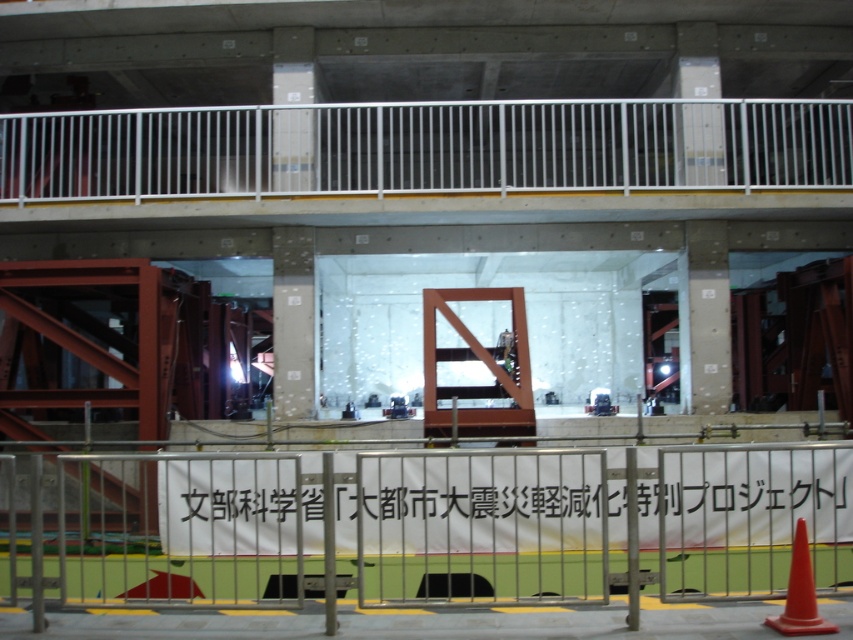
Consider the image. You are standing at the point labeled as point (433, 524) in the image. What object are you facing? Please answer with the object label from the scene.

The point (433, 524) corresponds to the silver metallic fence at lower center, so you are facing the silver metallic fence at lower center.

You are a visitor at the construction site and want to read the white paper banner at center. However, there is a silver metallic fence at lower center blocking your view. Can you see the banner clearly from your current position?

The silver metallic fence at lower center is in front of the white paper banner at center, so it is blocking your view. You cannot see the banner clearly from your current position.

You are a surveyor standing at the construction site. You need to determine the distance between the two points marked as point 1 at point (596, 490) and point 2 at point (726, 490). Given that point 1 is closer to you than point 2, can you estimate which point is higher in elevation?

Point 1 at point (596, 490) is closer to the camera than point 2 at point (726, 490), so point 1 is higher in elevation.